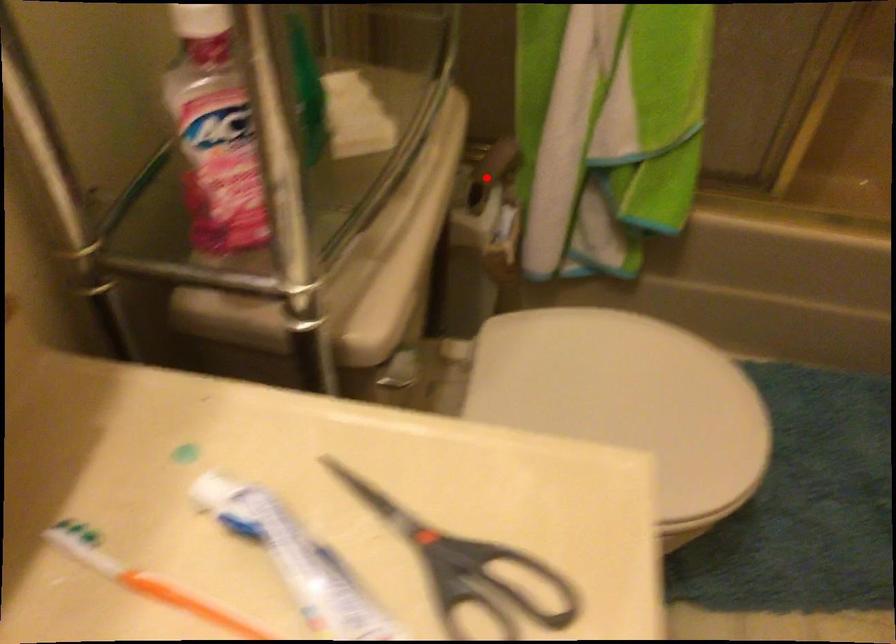
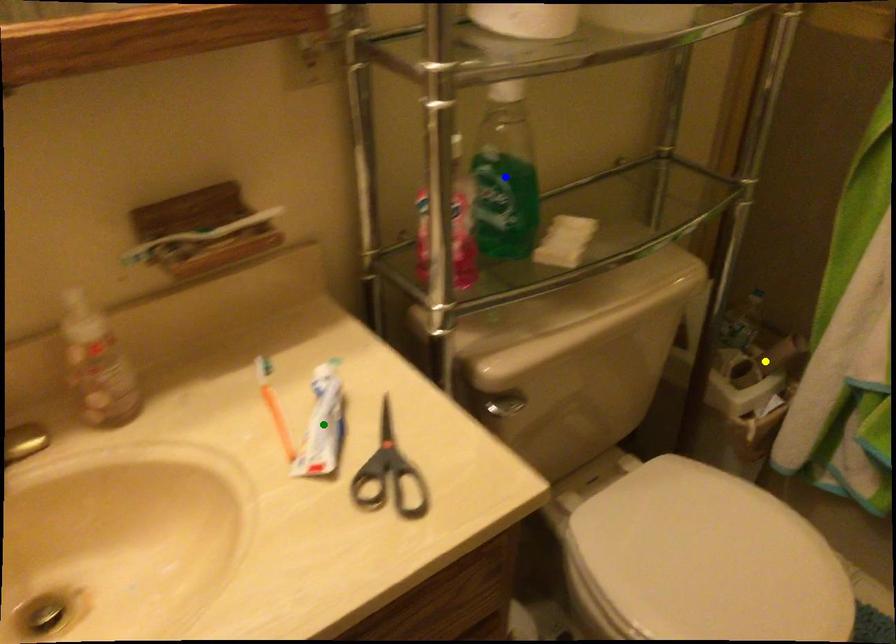
Question: I am providing you with two images of the same scene from different viewpoints. A red point is marked on the first image. You are given multiple points on the second image. Which spot in image 2 lines up with the point in image 1?

Choices:
 (A) yellow point
 (B) green point
 (C) blue point

Answer: (A)